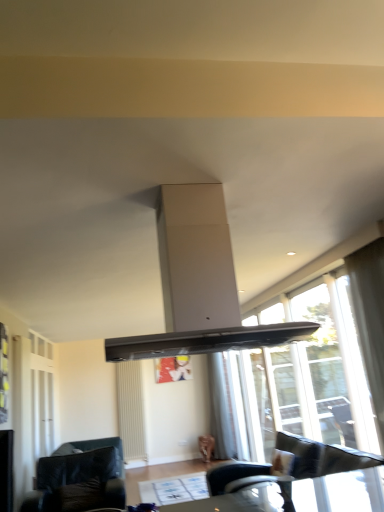
Image resolution: width=384 pixels, height=512 pixels. I want to click on white matte radiator at lower left, so click(x=131, y=410).

What do you see at coordinates (215, 505) in the screenshot? This screenshot has height=512, width=384. I see `matte black table at lower center` at bounding box center [215, 505].

Where is `matte black table at lower center`? matte black table at lower center is located at coordinates [x=215, y=505].

Identify the location of black leather couch at lower left. (80, 478).

What is the approximate width of black leather chair at lower right?

37.78 inches.

Locate an element on the screen. This screenshot has height=512, width=384. black leather chair at lower right is located at coordinates (290, 466).

What do you see at coordinates (310, 375) in the screenshot? I see `transparent glass window at right` at bounding box center [310, 375].

You are a GUI agent. You are given a task and a screenshot of the screen. Output one action in this format:
    pyautogui.click(x=<x>, y=<y>)
    Task: Click on the white sheer curtain at center
    
    Given the screenshot: What is the action you would take?
    click(x=221, y=409)

The height and width of the screenshot is (512, 384). What do you see at coordinates (221, 409) in the screenshot?
I see `white sheer curtain at center` at bounding box center [221, 409].

Locate an element on the screen. This screenshot has width=384, height=512. white matte radiator at lower left is located at coordinates (131, 410).

Considering the sizes of objects white matte radiator at lower left and matte black table at lower center in the image provided, who is wider, white matte radiator at lower left or matte black table at lower center?

matte black table at lower center is wider.

Is white matte radiator at lower left facing towards matte black table at lower center?

Yes, white matte radiator at lower left is turned towards matte black table at lower center.

Is matte black table at lower center a part of white matte radiator at lower left?

Actually, matte black table at lower center is outside white matte radiator at lower left.

Measure the distance from white matte radiator at lower left to matte black table at lower center.

white matte radiator at lower left is 1.80 meters from matte black table at lower center.

Is white sheer curtain at center inside the boundaries of black leather couch at lower left, or outside?

white sheer curtain at center is spatially situated outside black leather couch at lower left.

Is point (217, 419) positioned after point (111, 503)?

Yes, it is.

Considering the sizes of objects white sheer curtain at center and black leather couch at lower left in the image provided, who is taller, white sheer curtain at center or black leather couch at lower left?

white sheer curtain at center is taller.

From a real-world perspective, is white sheer curtain at center physically located above or below black leather couch at lower left?

Clearly, from a real-world perspective, white sheer curtain at center is above black leather couch at lower left.

In terms of size, does matte black table at lower center appear bigger or smaller than white matte radiator at lower left?

Clearly, matte black table at lower center is smaller in size than white matte radiator at lower left.

From a real-world perspective, is matte black table at lower center under white matte radiator at lower left?

Yes, from a real-world perspective, matte black table at lower center is beneath white matte radiator at lower left.

How different are the orientations of matte black table at lower center and white matte radiator at lower left in degrees?

The facing directions of matte black table at lower center and white matte radiator at lower left are 1.02 degrees apart.

Does matte black table at lower center have a greater height compared to white matte radiator at lower left?

In fact, matte black table at lower center may be shorter than white matte radiator at lower left.

Can you confirm if white matte exhaust hood at center is wider than white matte radiator at lower left?

Correct, the width of white matte exhaust hood at center exceeds that of white matte radiator at lower left.

Which is more to the right, white matte exhaust hood at center or white matte radiator at lower left?

white matte exhaust hood at center.

From a real-world perspective, who is located lower, white matte exhaust hood at center or white matte radiator at lower left?

white matte radiator at lower left, from a real-world perspective.

Is white matte exhaust hood at center spatially inside white matte radiator at lower left, or outside of it?

white matte exhaust hood at center is not enclosed by white matte radiator at lower left.

Is point (261, 340) more distant than point (44, 468)?

That is False.

Who is smaller, white matte exhaust hood at center or black leather couch at lower left?

With smaller size is white matte exhaust hood at center.

From the image's perspective, which one is positioned higher, white matte exhaust hood at center or black leather couch at lower left?

white matte exhaust hood at center appears higher in the image.

From a real-world perspective, is white matte exhaust hood at center located higher than black leather couch at lower left?

Indeed, from a real-world perspective, white matte exhaust hood at center stands above black leather couch at lower left.

Looking at this image, from a real-world perspective, is black leather couch at lower left under transparent glass window at right?

Indeed, from a real-world perspective, black leather couch at lower left is positioned beneath transparent glass window at right.

Can you confirm if black leather couch at lower left is positioned to the right of transparent glass window at right?

Incorrect, black leather couch at lower left is not on the right side of transparent glass window at right.

Considering the points (47, 501) and (331, 292), which point is in front, point (47, 501) or point (331, 292)?

Point (331, 292)

Does black leather couch at lower left have a greater width compared to transparent glass window at right?

Yes.

From a real-world perspective, who is located higher, white matte exhaust hood at center or black leather chair at lower right?

white matte exhaust hood at center, from a real-world perspective.

Which is more to the right, white matte exhaust hood at center or black leather chair at lower right?

From the viewer's perspective, black leather chair at lower right appears more on the right side.

Based on the photo, what's the angular difference between white matte exhaust hood at center and black leather chair at lower right's facing directions?

91.3 degrees.

You are a GUI agent. You are given a task and a screenshot of the screen. Output one action in this format:
    pyautogui.click(x=<x>, y=<y>)
    Task: Click on the exhaust hood in front of the black leather chair at lower right
    This screenshot has width=384, height=512.
    Given the screenshot: What is the action you would take?
    pyautogui.click(x=198, y=284)

Where is `round table lying in front of the white matte radiator at lower left`? The height and width of the screenshot is (512, 384). round table lying in front of the white matte radiator at lower left is located at coordinates (215, 505).

Where is `studio couch on the left of white sheer curtain at center`? This screenshot has width=384, height=512. studio couch on the left of white sheer curtain at center is located at coordinates (80, 478).

Considering their positions, is black leather couch at lower left positioned further to white matte radiator at lower left than black leather chair at lower right?

Among the two, black leather chair at lower right is located further to white matte radiator at lower left.

When comparing their distances from white sheer curtain at center, does black leather couch at lower left or white matte exhaust hood at center seem closer?

black leather couch at lower left is closer to white sheer curtain at center.

Looking at this image, considering their positions, is transparent glass window at right positioned further to black leather chair at lower right than black leather couch at lower left?

Based on the image, black leather couch at lower left appears to be further to black leather chair at lower right.

Looking at the image, which one is located further to white matte radiator at lower left, black leather couch at lower left or matte black table at lower center?

Based on the image, black leather couch at lower left appears to be further to white matte radiator at lower left.

Based on their spatial positions, is black leather couch at lower left or white sheer curtain at center closer to white matte radiator at lower left?

white sheer curtain at center lies closer to white matte radiator at lower left than the other object.

When comparing their distances from white matte exhaust hood at center, does white sheer curtain at center or matte black table at lower center seem further?

white sheer curtain at center.

Considering their positions, is white matte radiator at lower left positioned closer to black leather couch at lower left than transparent glass window at right?

white matte radiator at lower left is closer to black leather couch at lower left.

Looking at the image, which one is located further to black leather couch at lower left, transparent glass window at right or white matte exhaust hood at center?

The object further to black leather couch at lower left is white matte exhaust hood at center.

Find the location of a particular element. chair between white matte exhaust hood at center and white sheer curtain at center from front to back is located at coordinates (290, 466).

This screenshot has width=384, height=512. I want to click on curtain between matte black table at lower center and white matte radiator at lower left in the front-back direction, so click(x=221, y=409).

The image size is (384, 512). Identify the location of curtain positioned between black leather couch at lower left and white matte radiator at lower left from near to far. (221, 409).

Locate an element on the screen. The width and height of the screenshot is (384, 512). exhaust hood between black leather couch at lower left and transparent glass window at right is located at coordinates (198, 284).